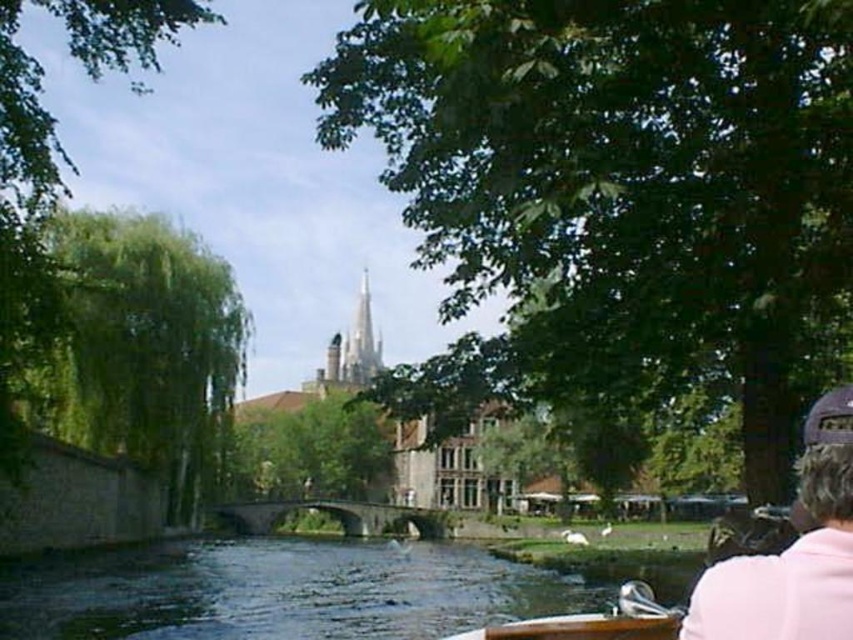
Question: Considering the real-world distances, which object is farthest from the dark green water at lower center?

Choices:
 (A) wooden boat at lower center
 (B) pink fabric cap at upper right

Answer: (B)

Question: Which of these objects is positioned closest to the dark green water at lower center?

Choices:
 (A) pink fabric cap at upper right
 (B) wooden boat at lower center

Answer: (B)

Question: Does dark green water at lower center have a greater width compared to wooden boat at lower center?

Choices:
 (A) no
 (B) yes

Answer: (B)

Question: From the image, what is the correct spatial relationship of dark green water at lower center in relation to wooden boat at lower center?

Choices:
 (A) above
 (B) below

Answer: (B)

Question: Is dark green water at lower center bigger than pink fabric cap at upper right?

Choices:
 (A) yes
 (B) no

Answer: (A)

Question: Among these points, which one is farthest from the camera?

Choices:
 (A) (614, 620)
 (B) (840, 636)
 (C) (426, 545)

Answer: (C)